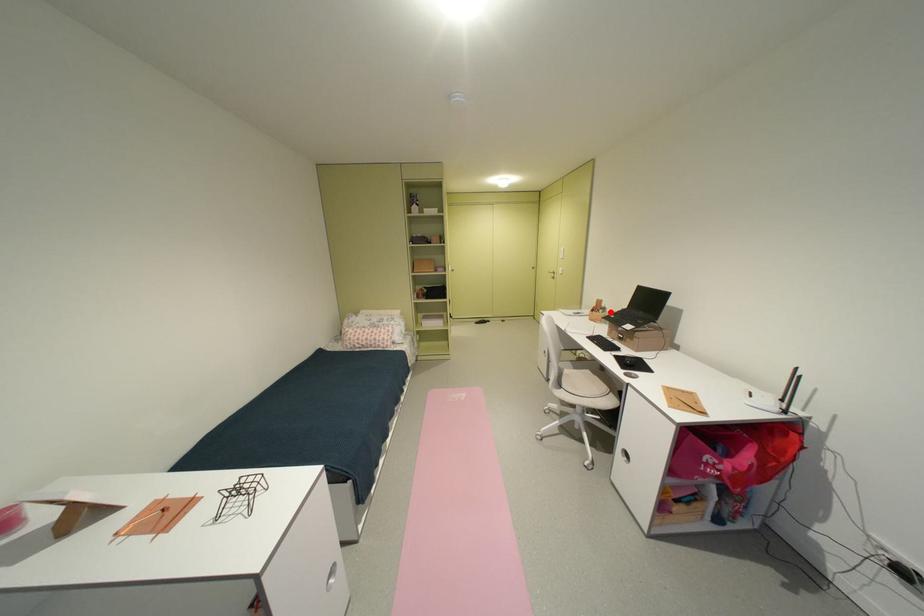
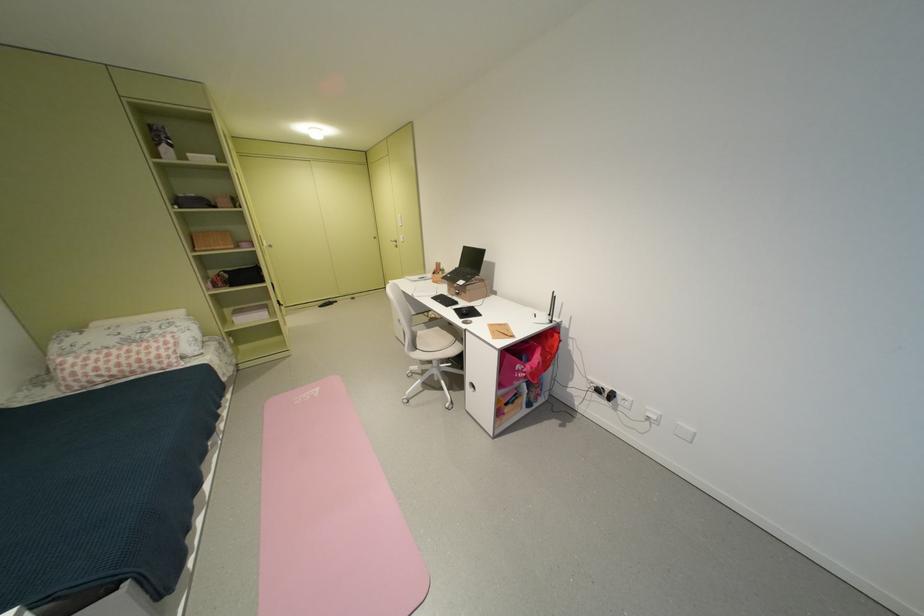
Where in the second image is the point corresponding to the highlighted location from the first image?

(450, 274)